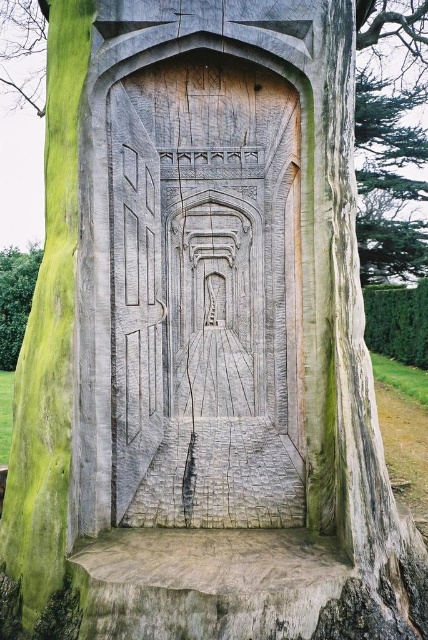
Is carved wood door at center in front of green wood tree at left?

Yes, it is.

Does carved wood door at center appear over green wood tree at left?

No, carved wood door at center is not above green wood tree at left.

Is point (208, 97) positioned after point (12, 307)?

That is False.

Locate an element on the screen. This screenshot has width=428, height=640. carved wood door at center is located at coordinates (205, 296).